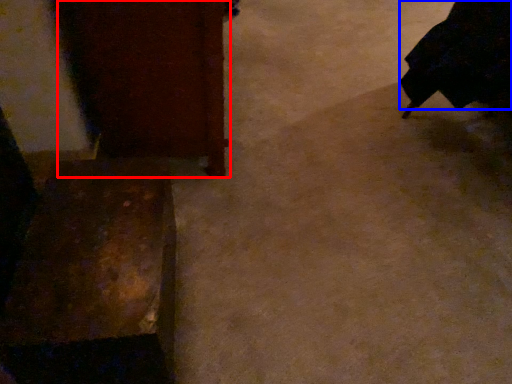
Question: Which object is closer to the camera taking this photo, furniture (highlighted by a red box) or robe (highlighted by a blue box)?

Choices:
 (A) furniture
 (B) robe

Answer: (A)